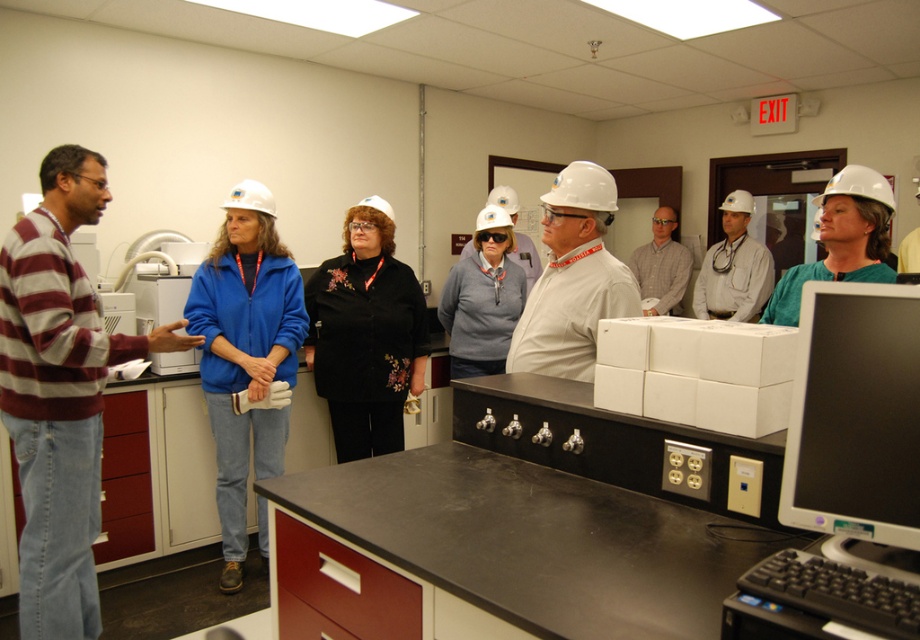
Question: Which object appears closest to the camera in this image?

Choices:
 (A) green matte hard hat at upper right
 (B) black glossy monitor at lower right
 (C) black velvet jacket at center
 (D) striped sweater at left

Answer: (B)

Question: Which point appears farthest from the camera in this image?

Choices:
 (A) (897, 332)
 (B) (652, 244)

Answer: (B)

Question: Does black glossy monitor at lower right come in front of gray checkered shirt at center?

Choices:
 (A) yes
 (B) no

Answer: (A)

Question: Which object is closer to the camera taking this photo?

Choices:
 (A) black velvet jacket at center
 (B) gray fleece jacket at center
 (C) green matte hard hat at upper right

Answer: (C)

Question: Does striped sweater at left have a larger size compared to blue fabric jacket at center?

Choices:
 (A) no
 (B) yes

Answer: (B)

Question: Does blue fabric jacket at center appear on the right side of gray fleece jacket at center?

Choices:
 (A) no
 (B) yes

Answer: (A)